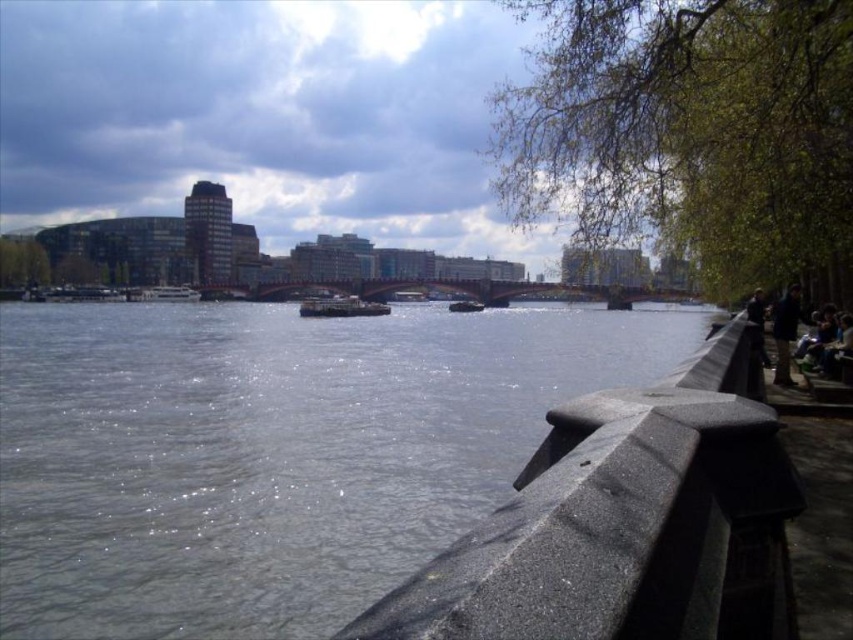
Does gray concrete river at center appear on the left side of gray concrete rail at lower right?

Yes, gray concrete river at center is to the left of gray concrete rail at lower right.

Does gray concrete river at center appear on the right side of gray concrete rail at lower right?

No, gray concrete river at center is not to the right of gray concrete rail at lower right.

Image resolution: width=853 pixels, height=640 pixels. What are the coordinates of `gray concrete river at center` in the screenshot? It's located at (271, 451).

Does gray concrete rail at lower right appear on the left side of dark blue jacket at right?

Indeed, gray concrete rail at lower right is positioned on the left side of dark blue jacket at right.

Who is more forward, (708, 406) or (788, 300)?

Point (708, 406) is in front.

Is point (582, 632) positioned behind point (785, 384)?

No, (582, 632) is closer to viewer.

Locate an element on the screen. gray concrete rail at lower right is located at coordinates tap(625, 524).

Is gray concrete river at center below dark blue jacket at right?

Yes, gray concrete river at center is below dark blue jacket at right.

Can you confirm if gray concrete river at center is shorter than dark blue jacket at right?

No, gray concrete river at center is not shorter than dark blue jacket at right.

Locate an element on the screen. Image resolution: width=853 pixels, height=640 pixels. gray concrete river at center is located at coordinates (271, 451).

Where is `gray concrete river at center`? gray concrete river at center is located at coordinates (271, 451).